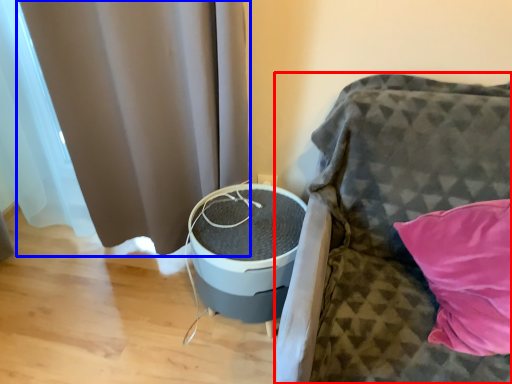
Question: Which object appears farthest to the camera in this image, furniture (highlighted by a red box) or curtain (highlighted by a blue box)?

Choices:
 (A) furniture
 (B) curtain

Answer: (B)